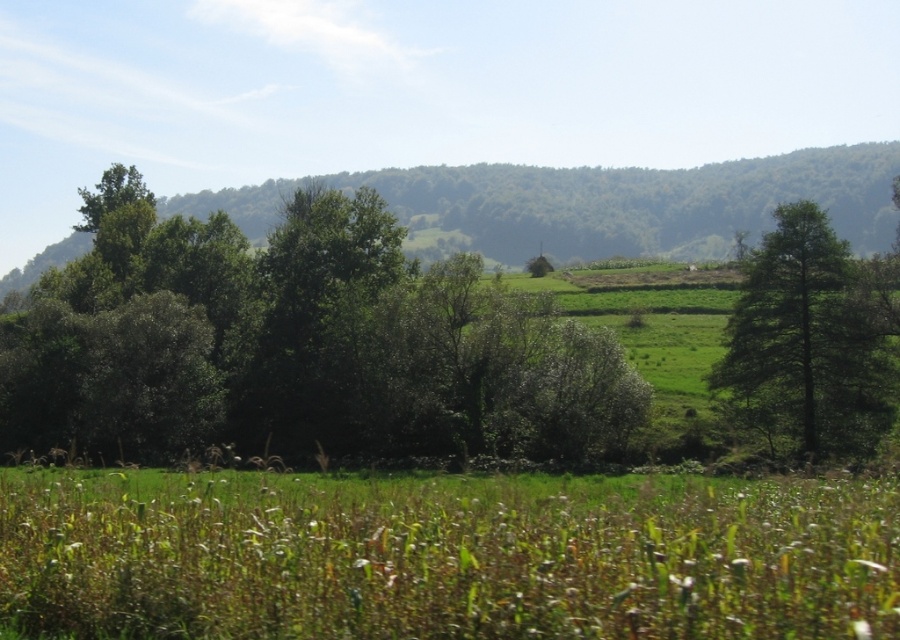
Question: Is green leafy tree at center further to the viewer compared to green leafy tree at right?

Choices:
 (A) yes
 (B) no

Answer: (A)

Question: Is green grassy pasture at lower center below green leafy tree at center?

Choices:
 (A) no
 (B) yes

Answer: (B)

Question: Which point is farther to the camera?

Choices:
 (A) (576, 564)
 (B) (176, 387)

Answer: (B)

Question: Does green grassy pasture at lower center come in front of green leafy tree at center?

Choices:
 (A) yes
 (B) no

Answer: (A)

Question: Considering the real-world distances, which object is closest to the green leafy tree at right?

Choices:
 (A) green leafy tree at center
 (B) green grassy pasture at lower center

Answer: (A)

Question: Which point is closer to the camera?

Choices:
 (A) (882, 372)
 (B) (318, 595)

Answer: (B)